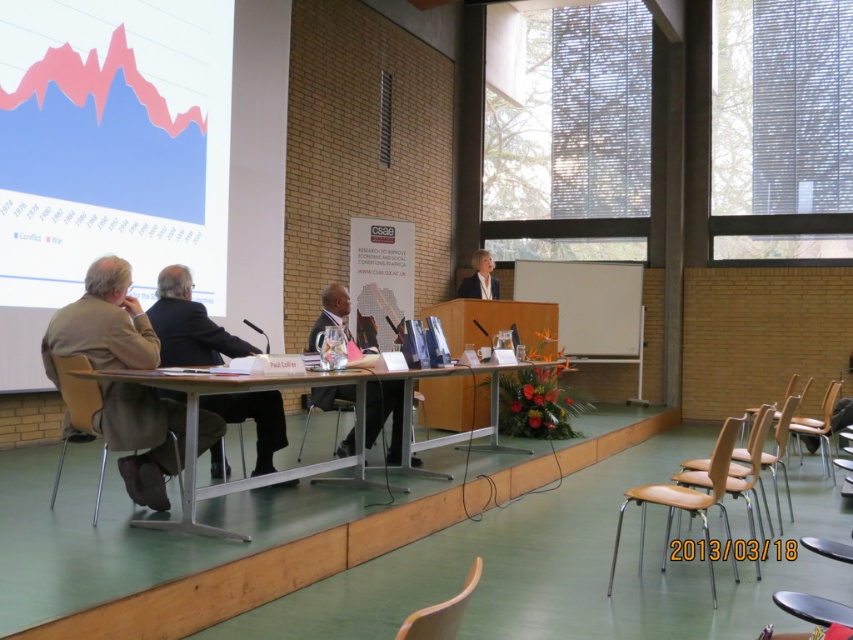
You are organizing a small event and need to place a rectangular table between the brown leather jacket at left and the wooden chair at lower right. Can the table fit if it is 1.2 meters wide?

The brown leather jacket at left is narrower than the wooden chair at lower right. Since the table is 1.2 meters wide, and the space between them depends on their widths, but the exact distance isn answerable with the given info. However, since the jacket is narrower, there might be enough space. But without knowing the exact distance between them, we cannot confirm. The answer should state that the information provided is insufficient to determine if the table will fit.

You are an attendee at the conference and need to locate the brown leather jacket at left. Based on the coordinates provided, where would you find it in the image?

The brown leather jacket at left is located at coordinates point (x=102, y=323) in the image.